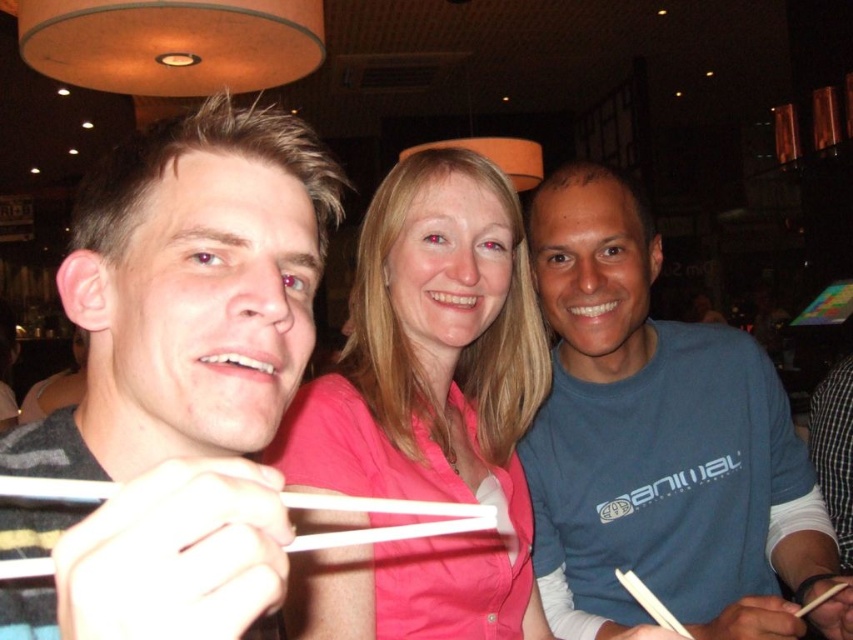
Question: Can you confirm if white plastic chopstick at lower right is thinner than wooden chopstick at lower right?

Choices:
 (A) yes
 (B) no

Answer: (B)

Question: Estimate the real-world distances between objects in this image. Which object is farther from the white plastic chopsticks at lower left?

Choices:
 (A) white plastic chopstick at lower right
 (B) blue cotton shirt at center
 (C) wooden chopstick at lower right
 (D) gray striped shirt at left

Answer: (C)

Question: Which object appears farthest from the camera in this image?

Choices:
 (A) wooden chopstick at lower right
 (B) gray striped shirt at left
 (C) white plastic chopsticks at lower left

Answer: (A)

Question: Considering the relative positions of pink fabric shirt at center and white plastic chopsticks at lower left in the image provided, where is pink fabric shirt at center located with respect to white plastic chopsticks at lower left?

Choices:
 (A) left
 (B) right

Answer: (B)

Question: Based on their relative distances, which object is nearer to the white plastic chopsticks at lower left?

Choices:
 (A) wooden chopstick at lower right
 (B) pink fabric shirt at center
 (C) white plastic chopstick at lower right

Answer: (B)

Question: Is the position of pink fabric shirt at center more distant than that of white plastic chopstick at lower right?

Choices:
 (A) no
 (B) yes

Answer: (A)